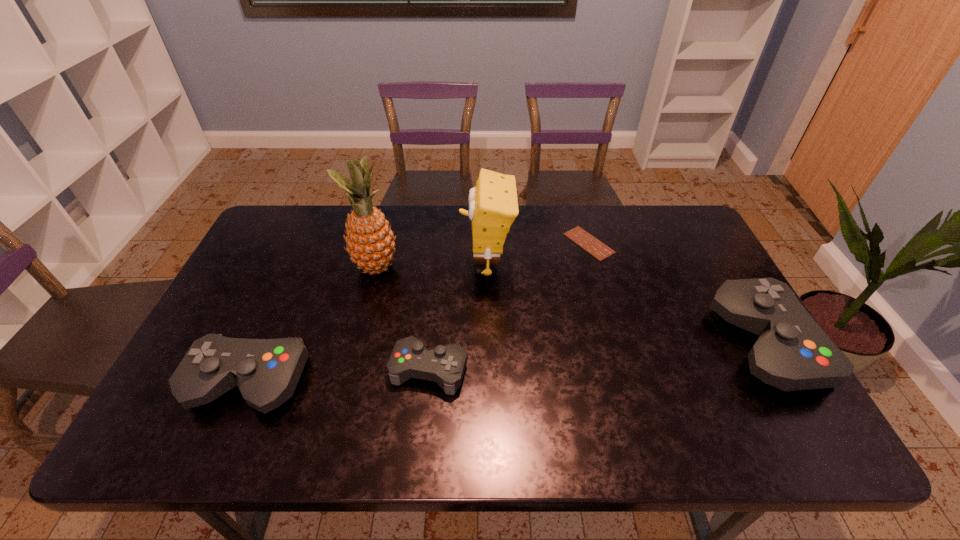
Find the location of a particular element. This screenshot has width=960, height=540. free region located on the back of the leftmost control is located at coordinates (282, 307).

I want to click on vacant space located on the left of the second control from left to right, so click(x=232, y=370).

Identify the location of vacant space located on the left of the rightmost object. This screenshot has height=540, width=960. (672, 345).

Where is `free space located 0.050m on the face of the second tallest object`? free space located 0.050m on the face of the second tallest object is located at coordinates (444, 264).

The height and width of the screenshot is (540, 960). Find the location of `free space located on the face of the second tallest object`. free space located on the face of the second tallest object is located at coordinates (406, 264).

Find the location of a particular element. This screenshot has width=960, height=540. vacant region located 0.240m on the face of the second tallest object is located at coordinates (384, 264).

Image resolution: width=960 pixels, height=540 pixels. Find the location of `vacant position located on the left of the chocolate bar`. vacant position located on the left of the chocolate bar is located at coordinates (473, 243).

You are a GUI agent. You are given a task and a screenshot of the screen. Output one action in this format:
    pyautogui.click(x=<x>, y=<y>)
    Task: Click on the vacant space located 0.270m on the front of the second object from left to right
    
    Given the screenshot: What is the action you would take?
    pyautogui.click(x=351, y=364)

This screenshot has height=540, width=960. Find the location of `sponge present at the far edge`. sponge present at the far edge is located at coordinates (493, 205).

You are a GUI agent. You are given a task and a screenshot of the screen. Output one action in this format:
    pyautogui.click(x=<x>, y=<y>)
    Task: Click on the chocolate bar located at the far edge
    This screenshot has width=960, height=540.
    Given the screenshot: What is the action you would take?
    pyautogui.click(x=589, y=243)